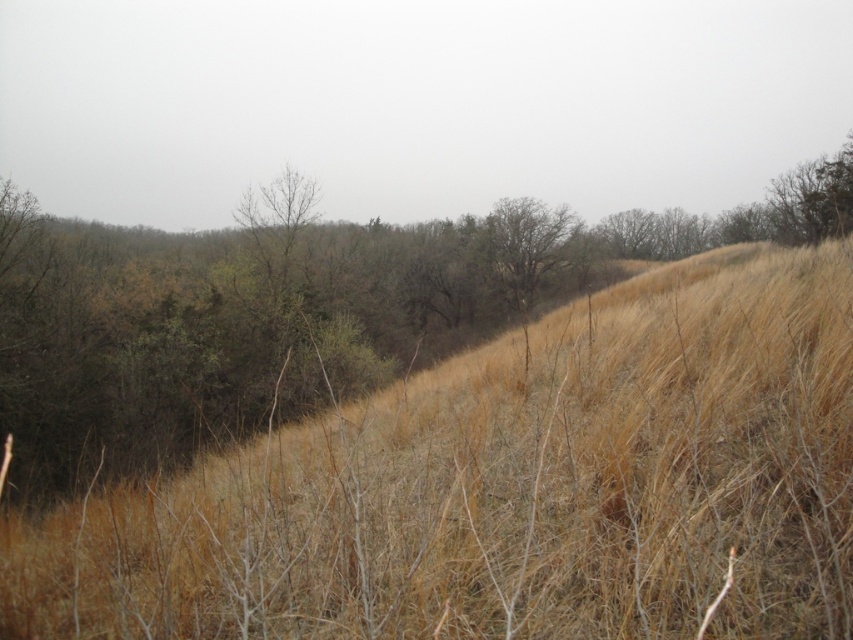
Can you confirm if dry grass at center is thinner than bare wood tree at center?

No.

Between dry grass at center and bare wood tree at center, which one is positioned higher?

Positioned higher is bare wood tree at center.

Is point (189, 561) farther from viewer compared to point (534, 202)?

No, it is in front of (534, 202).

The image size is (853, 640). I want to click on dry grass at center, so click(511, 486).